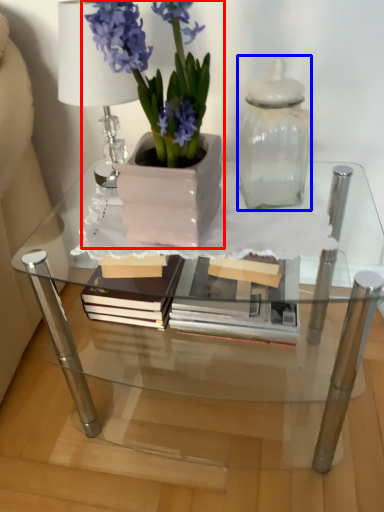
Question: Among these objects, which one is nearest to the camera, houseplant (highlighted by a red box) or glass vase (highlighted by a blue box)?

Choices:
 (A) houseplant
 (B) glass vase

Answer: (A)